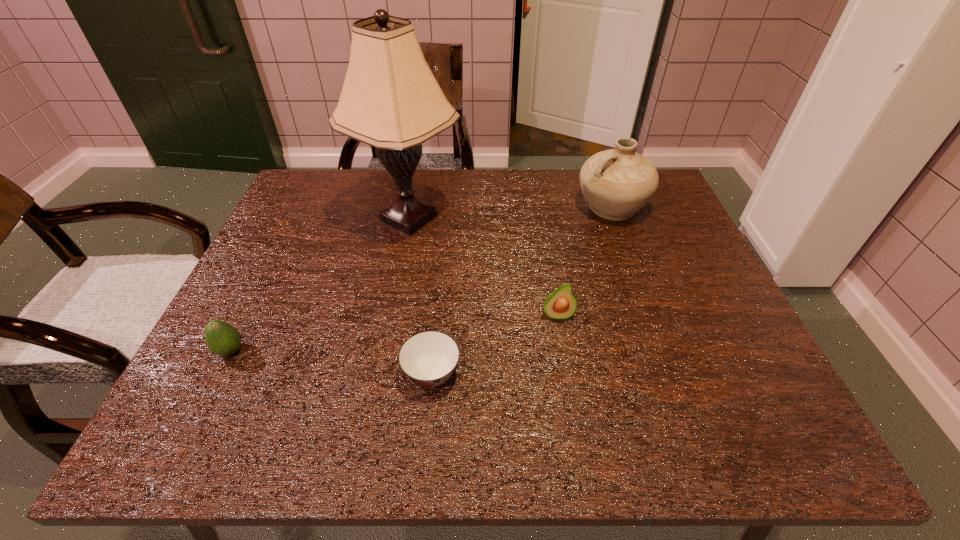
In the image, there is a desktop. At what (x,y) coordinates should I click in order to perform the action: click on vacant space at the right edge. Please return your answer as a coordinate pair (x, y). The height and width of the screenshot is (540, 960). Looking at the image, I should click on (672, 249).

In the image, there is a desktop. Where is `free space at the far left corner`? This screenshot has height=540, width=960. free space at the far left corner is located at coordinates (316, 207).

Identify the location of free area in between the second object from right to left and the second tallest object. The width and height of the screenshot is (960, 540). (585, 261).

This screenshot has width=960, height=540. What are the coordinates of `vacant space that is in between the rightmost object and the soup bowl` in the screenshot? It's located at (521, 291).

Find the location of `vacant point located between the shortest object and the tallest object`. vacant point located between the shortest object and the tallest object is located at coordinates (420, 296).

Image resolution: width=960 pixels, height=540 pixels. In order to click on free space between the shortest object and the fourth shortest object in this screenshot , I will do `click(521, 291)`.

Locate an element on the screen. Image resolution: width=960 pixels, height=540 pixels. free spot between the lamp and the third nearest object is located at coordinates (483, 267).

The width and height of the screenshot is (960, 540). Identify the location of free spot between the left avocado and the pottery. (421, 279).

Where is `vacant area that lies between the third farthest object and the shortest object`? The width and height of the screenshot is (960, 540). vacant area that lies between the third farthest object and the shortest object is located at coordinates (494, 345).

Locate an element on the screen. blank region between the fourth shortest object and the lamp is located at coordinates (510, 213).